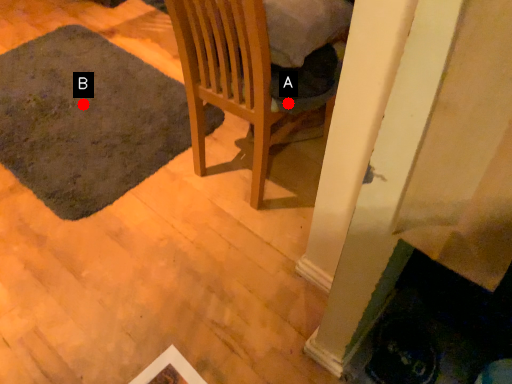
Question: Two points are circled on the image, labeled by A and B beside each circle. Which point is farther from the camera taking this photo?

Choices:
 (A) A is further
 (B) B is further

Answer: (B)